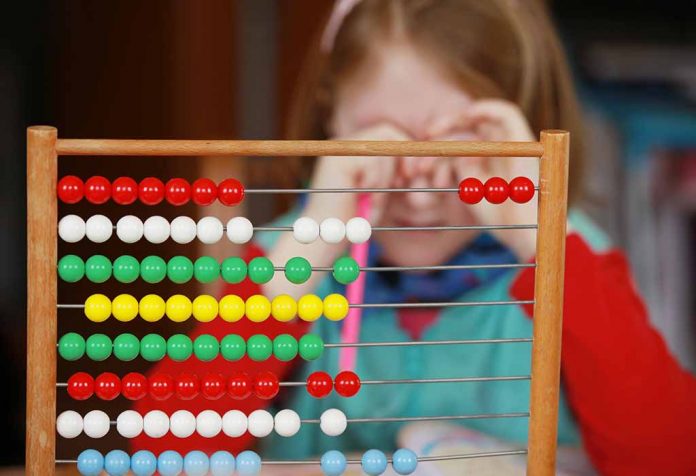
This screenshot has height=476, width=696. Find the location of `abucus bead wires`. abucus bead wires is located at coordinates click(x=402, y=190), click(x=436, y=228), click(x=443, y=266), click(x=452, y=301), click(x=461, y=339), click(x=459, y=377), click(x=465, y=416), click(x=463, y=457).